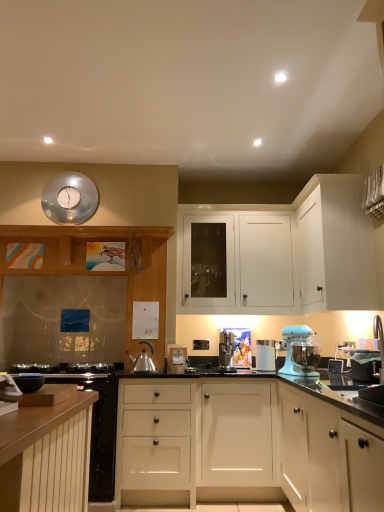
Question: Considering the relative sizes of metallic reflective clock at upper center and white matte cabinet at lower left, which is the fourth cabinetry in back-to-front order, in the image provided, is metallic reflective clock at upper center smaller than white matte cabinet at lower left, which is the fourth cabinetry in back-to-front order,?

Choices:
 (A) yes
 (B) no

Answer: (A)

Question: Does metallic reflective clock at upper center appear on the right side of white matte cabinet at lower left, acting as the third cabinetry starting from the front?

Choices:
 (A) no
 (B) yes

Answer: (A)

Question: Is metallic reflective clock at upper center not within white matte cabinet at lower left, which is the fourth cabinetry in back-to-front order?

Choices:
 (A) no
 (B) yes

Answer: (B)

Question: From the image's perspective, is metallic reflective clock at upper center over white matte cabinet at lower left, acting as the third cabinetry starting from the front?

Choices:
 (A) no
 (B) yes

Answer: (B)

Question: Is metallic reflective clock at upper center touching white matte cabinet at lower left, which is the fourth cabinetry in back-to-front order?

Choices:
 (A) no
 (B) yes

Answer: (A)

Question: Is metallic reflective clock at upper center positioned in front of white matte cabinet at lower left, acting as the third cabinetry starting from the front?

Choices:
 (A) no
 (B) yes

Answer: (A)

Question: Can you confirm if satin silver coffee machine at center, the second kitchen appliance when ordered from right to left, is positioned to the right of white plastic container at center, which ranks as the 2th kitchen appliance in left-to-right order?

Choices:
 (A) no
 (B) yes

Answer: (A)

Question: Is satin silver coffee machine at center, the second kitchen appliance when ordered from right to left, outside white plastic container at center, acting as the first kitchen appliance starting from the right?

Choices:
 (A) yes
 (B) no

Answer: (A)

Question: Is satin silver coffee machine at center, positioned as the 1th kitchen appliance in left-to-right order, not close to white plastic container at center, acting as the first kitchen appliance starting from the right?

Choices:
 (A) no
 (B) yes

Answer: (A)

Question: Is satin silver coffee machine at center, positioned as the 1th kitchen appliance in left-to-right order, shorter than white plastic container at center, acting as the first kitchen appliance starting from the right?

Choices:
 (A) yes
 (B) no

Answer: (B)

Question: Is satin silver coffee machine at center, positioned as the 1th kitchen appliance in left-to-right order, closer to the viewer compared to white plastic container at center, which ranks as the 2th kitchen appliance in left-to-right order?

Choices:
 (A) no
 (B) yes

Answer: (B)

Question: Is satin silver coffee machine at center, positioned as the 1th kitchen appliance in left-to-right order, directly adjacent to white plastic container at center, acting as the first kitchen appliance starting from the right?

Choices:
 (A) no
 (B) yes

Answer: (A)

Question: From the image's perspective, would you say wooden cabinet at left, the 2th cabinetry in the back-to-front sequence, is shown under matte white cabinet at lower right, which ranks as the 6th cabinetry in back-to-front order?

Choices:
 (A) no
 (B) yes

Answer: (A)